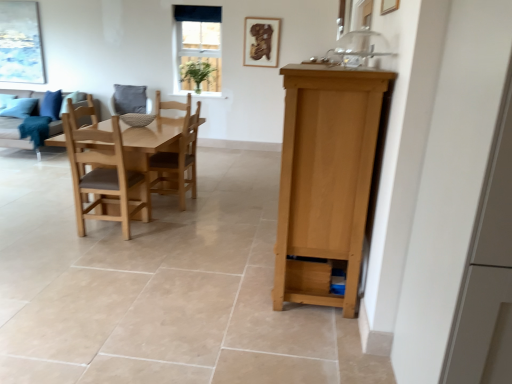
Question: From a real-world perspective, is wooden drawer at lower center on matte gray fabric couch at left?

Choices:
 (A) yes
 (B) no

Answer: (B)

Question: Does wooden drawer at lower center turn towards matte gray fabric couch at left?

Choices:
 (A) no
 (B) yes

Answer: (A)

Question: Considering the relative positions of wooden drawer at lower center and matte gray fabric couch at left in the image provided, is wooden drawer at lower center to the left of matte gray fabric couch at left from the viewer's perspective?

Choices:
 (A) yes
 (B) no

Answer: (B)

Question: Can you confirm if wooden drawer at lower center is wider than matte gray fabric couch at left?

Choices:
 (A) yes
 (B) no

Answer: (B)

Question: From the image's perspective, would you say wooden drawer at lower center is shown under matte gray fabric couch at left?

Choices:
 (A) no
 (B) yes

Answer: (B)

Question: Considering the relative positions of wooden drawer at lower center and matte gray fabric couch at left in the image provided, is wooden drawer at lower center to the right of matte gray fabric couch at left from the viewer's perspective?

Choices:
 (A) no
 (B) yes

Answer: (B)

Question: Is wooden picture frame at upper center, the 2th picture frame when ordered from back to front, positioned with its back to matte gray fabric couch at left?

Choices:
 (A) yes
 (B) no

Answer: (B)

Question: Does wooden picture frame at upper center, the second picture frame positioned from the left, lie behind matte gray fabric couch at left?

Choices:
 (A) yes
 (B) no

Answer: (A)

Question: Is wooden picture frame at upper center, placed as the 1th picture frame when sorted from front to back, at the right side of matte gray fabric couch at left?

Choices:
 (A) yes
 (B) no

Answer: (A)

Question: Does wooden picture frame at upper center, placed as the 1th picture frame when sorted from front to back, turn towards matte gray fabric couch at left?

Choices:
 (A) yes
 (B) no

Answer: (B)

Question: Can you confirm if wooden picture frame at upper center, the 2th picture frame when ordered from back to front, is shorter than matte gray fabric couch at left?

Choices:
 (A) yes
 (B) no

Answer: (A)

Question: From a real-world perspective, does wooden picture frame at upper center, placed as the 1th picture frame when sorted from front to back, stand above matte gray fabric couch at left?

Choices:
 (A) yes
 (B) no

Answer: (A)

Question: Is the depth of white glass window at upper center greater than that of light brown wooden table at center?

Choices:
 (A) no
 (B) yes

Answer: (B)